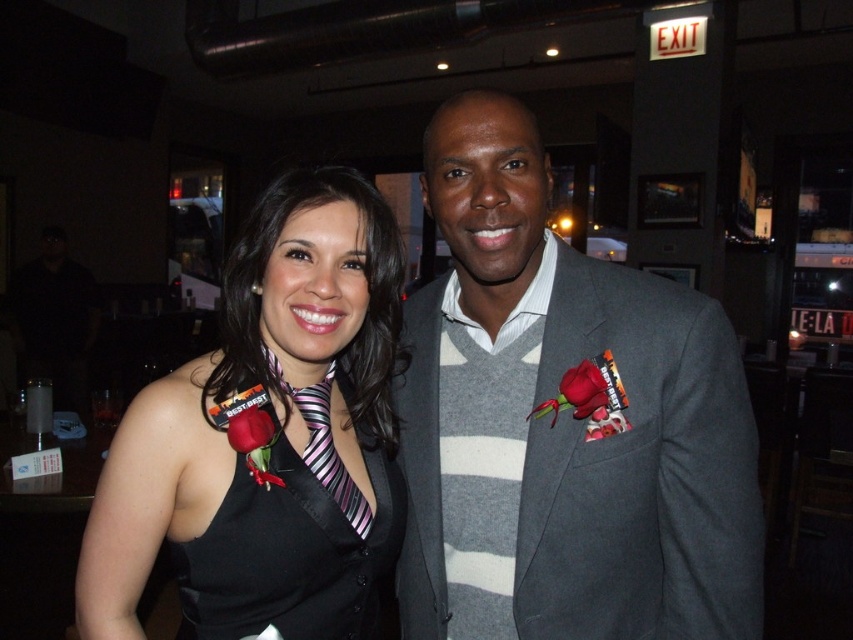
You are a photographer adjusting the lighting for a closeup shot of the black satin dress at center and the striped fabric tie at center. The camera requires the two items to be within 3 inches of each other to focus properly. Based on the scene description, will the camera be able to focus on both items simultaneously?

The distance between the black satin dress at center and the striped fabric tie at center is 2.88 inches, which is within the 3 inch requirement. Therefore, the camera can focus on both items simultaneously.

You are standing at the entrance of the venue and want to take a photo of the black satin dress at left. Which direction should you face to ensure the dress is in the frame?

The black satin dress at left is located at point (276, 444), so you should face towards the left side of the venue to capture it in your photo.

You are a photographer standing at the camera position. You need to adjust the focus to the black satin dress at center. What are the coordinates you should aim for?

The coordinates to focus on the black satin dress at center are at point (294, 554).